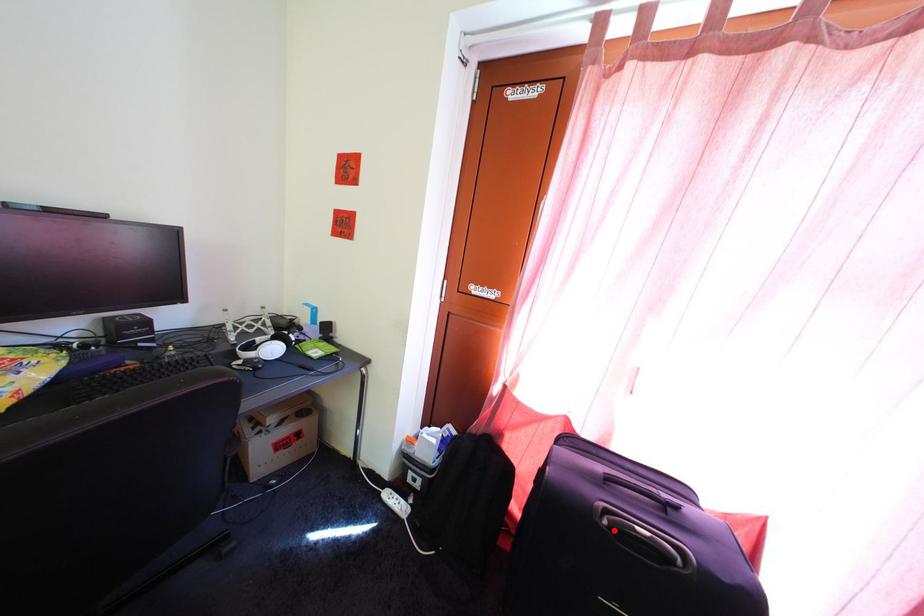
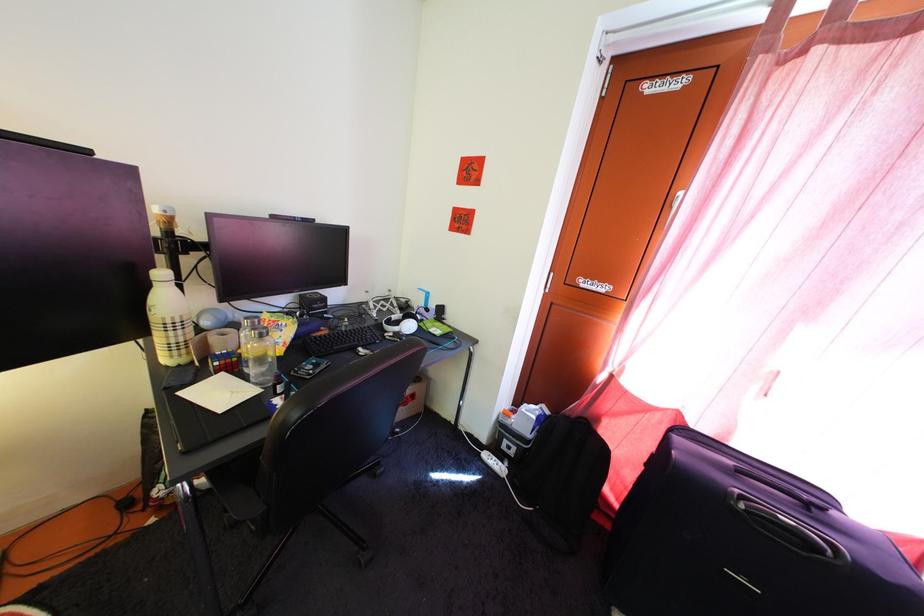
Locate, in the second image, the point that corresponds to the highlighted location in the first image.

(751, 515)